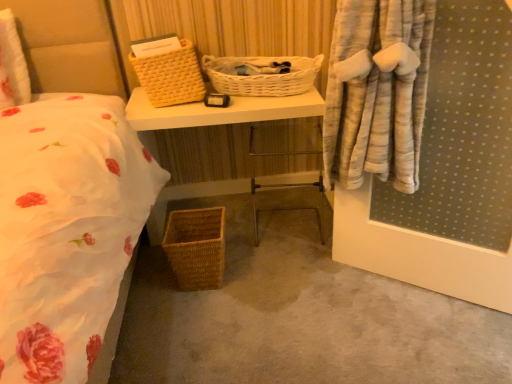
Where is `vacant area that lies in front of metallic silver chair at center`? vacant area that lies in front of metallic silver chair at center is located at coordinates (290, 268).